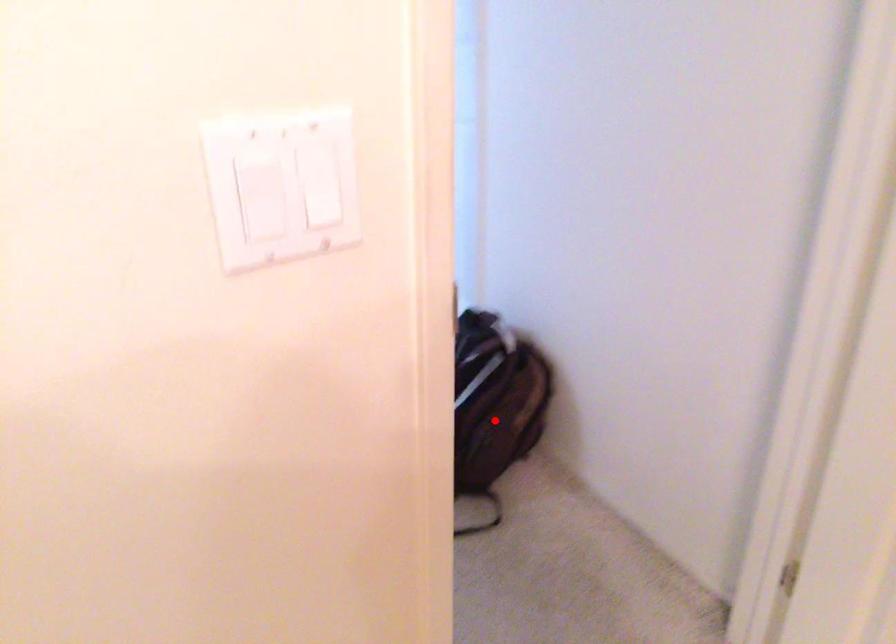
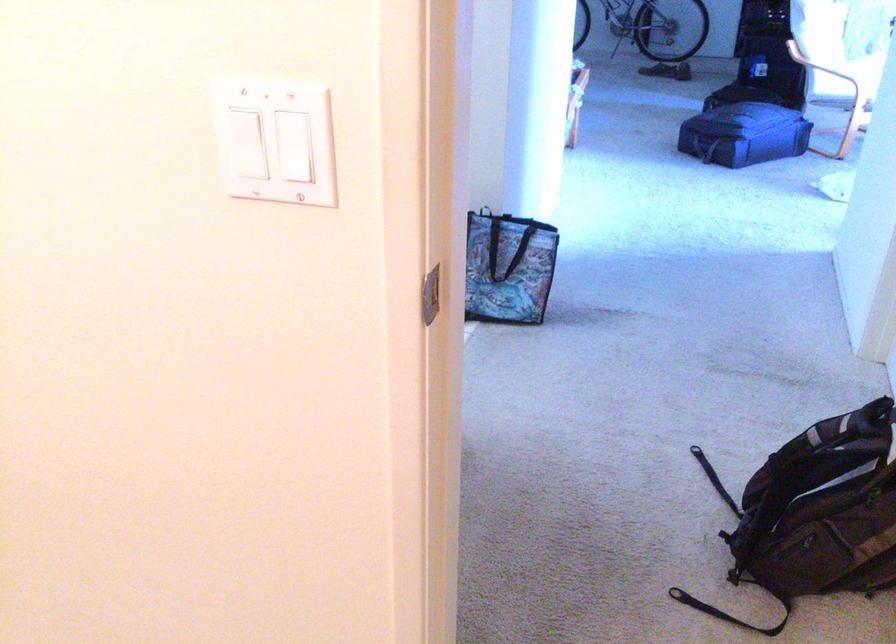
Question: I am providing you with two images of the same scene from different viewpoints. Given a red point in image1, look at the same physical point in image2. Is it:

Choices:
 (A) Closer to the viewpoint
 (B) Farther from the viewpoint

Answer: (A)